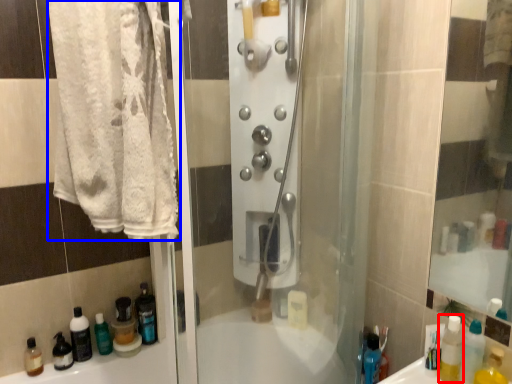
Question: Which point is closer to the camera, mouthwash (highlighted by a red box) or towel (highlighted by a blue box)?

Choices:
 (A) mouthwash
 (B) towel

Answer: (B)